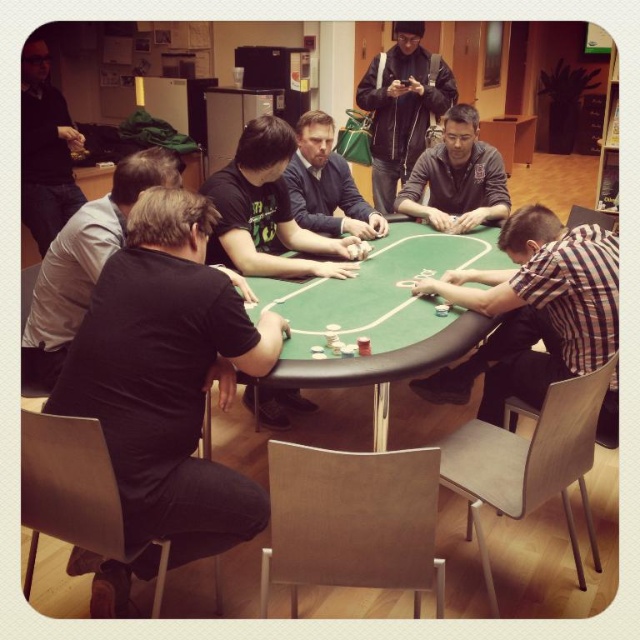
Can you confirm if black matte shirt at left is smaller than matte blue shirt at center?

Incorrect, black matte shirt at left is not smaller in size than matte blue shirt at center.

Is black matte shirt at left positioned in front of matte blue shirt at center?

Yes, it is in front of matte blue shirt at center.

What do you see at coordinates (168, 378) in the screenshot?
I see `black matte shirt at left` at bounding box center [168, 378].

Identify the location of black matte shirt at left. This screenshot has width=640, height=640. (168, 378).

Can you confirm if dark blue jacket at upper center is thinner than matte blue shirt at center?

Incorrect, dark blue jacket at upper center's width is not less than matte blue shirt at center's.

This screenshot has width=640, height=640. Describe the element at coordinates (403, 108) in the screenshot. I see `dark blue jacket at upper center` at that location.

The width and height of the screenshot is (640, 640). Identify the location of dark blue jacket at upper center. (403, 108).

Can you confirm if green felt poker table at center is taller than dark blue jacket at upper center?

No.

Which is in front, point (401, 264) or point (378, 164)?

Point (401, 264) is in front.

Does point (452, 330) come closer to viewer compared to point (406, 84)?

Yes, point (452, 330) is closer to viewer.

The height and width of the screenshot is (640, 640). Identify the location of green felt poker table at center. (381, 317).